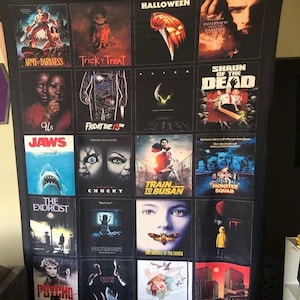
At what (x,y) coordinates should I click in order to perform the action: click on jaws poster. Please return your answer as a coordinate pair (x, y). Looking at the image, I should click on (53, 150).